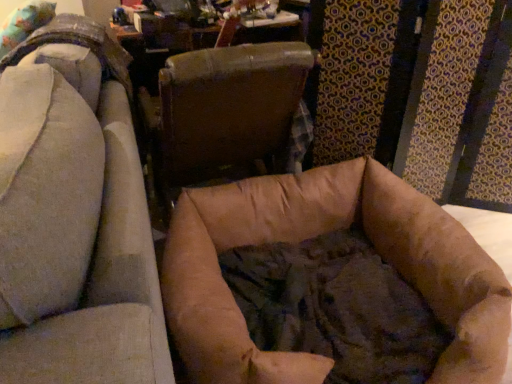
Question: Which direction should I rotate to face brown leather chair at center, arranged as the first chair when viewed from the right, — up or down?

Choices:
 (A) down
 (B) up

Answer: (B)

Question: Should I look upward or downward to see brown fabric dog bed at center, acting as the 1th chair starting from the left?

Choices:
 (A) up
 (B) down

Answer: (B)

Question: From a real-world perspective, does brown leather chair at center, the second chair positioned from the left, stand above brown fabric dog bed at center, positioned as the 2th chair in right-to-left order?

Choices:
 (A) yes
 (B) no

Answer: (B)

Question: Does brown leather chair at center, arranged as the first chair when viewed from the right, come in front of brown fabric dog bed at center, positioned as the 2th chair in right-to-left order?

Choices:
 (A) no
 (B) yes

Answer: (A)

Question: Would you say brown leather chair at center, arranged as the first chair when viewed from the right, is a long distance from brown fabric dog bed at center, positioned as the 2th chair in right-to-left order?

Choices:
 (A) yes
 (B) no

Answer: (B)

Question: Is brown leather chair at center, the second chair positioned from the left, further to camera compared to brown fabric dog bed at center, acting as the 1th chair starting from the left?

Choices:
 (A) no
 (B) yes

Answer: (B)

Question: Is brown leather chair at center, arranged as the first chair when viewed from the right, outside of brown fabric dog bed at center, acting as the 1th chair starting from the left?

Choices:
 (A) yes
 (B) no

Answer: (A)

Question: Can you confirm if brown leather chair at center, the second chair positioned from the left, is positioned to the left of brown fabric dog bed at center, positioned as the 2th chair in right-to-left order?

Choices:
 (A) no
 (B) yes

Answer: (A)

Question: Considering the relative sizes of brown fabric dog bed at center, acting as the 1th chair starting from the left, and brown leather chair at center, the second chair positioned from the left, in the image provided, is brown fabric dog bed at center, acting as the 1th chair starting from the left, thinner than brown leather chair at center, the second chair positioned from the left,?

Choices:
 (A) no
 (B) yes

Answer: (A)

Question: Is brown fabric dog bed at center, acting as the 1th chair starting from the left, positioned in front of brown leather chair at center, arranged as the first chair when viewed from the right?

Choices:
 (A) no
 (B) yes

Answer: (B)

Question: Is brown fabric dog bed at center, acting as the 1th chair starting from the left, taller than brown leather chair at center, the second chair positioned from the left?

Choices:
 (A) no
 (B) yes

Answer: (B)

Question: Would you say brown fabric dog bed at center, positioned as the 2th chair in right-to-left order, is outside brown leather chair at center, arranged as the first chair when viewed from the right?

Choices:
 (A) yes
 (B) no

Answer: (A)

Question: Considering the relative positions of brown fabric dog bed at center, acting as the 1th chair starting from the left, and brown leather chair at center, the second chair positioned from the left, in the image provided, is brown fabric dog bed at center, acting as the 1th chair starting from the left, to the right of brown leather chair at center, the second chair positioned from the left, from the viewer's perspective?

Choices:
 (A) no
 (B) yes

Answer: (A)

Question: Considering the relative sizes of brown fabric dog bed at center, acting as the 1th chair starting from the left, and brown leather chair at center, arranged as the first chair when viewed from the right, in the image provided, is brown fabric dog bed at center, acting as the 1th chair starting from the left, shorter than brown leather chair at center, arranged as the first chair when viewed from the right,?

Choices:
 (A) no
 (B) yes

Answer: (A)

Question: Is brown leather chair at center, the second chair positioned from the left, to the left or to the right of brown fabric dog bed at center, acting as the 1th chair starting from the left, in the image?

Choices:
 (A) right
 (B) left

Answer: (A)